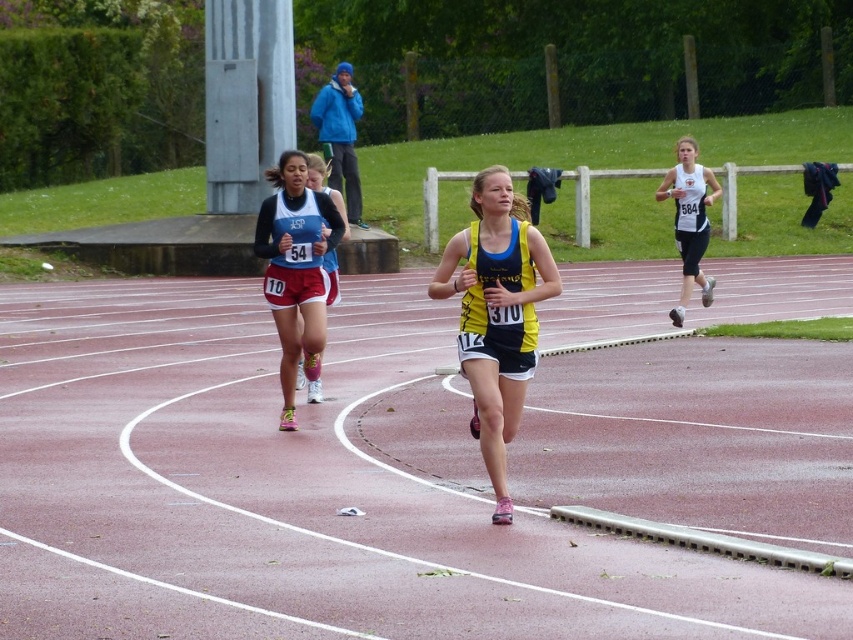
Looking at this image, is matte black shorts at center thinner than white athletic top at right?

Yes, matte black shorts at center is thinner than white athletic top at right.

Between point (291, 339) and point (688, 296), which one is positioned behind?

Point (688, 296)

Which is behind, point (282, 298) or point (656, 195)?

The point (656, 195) is more distant.

You are a GUI agent. You are given a task and a screenshot of the screen. Output one action in this format:
    pyautogui.click(x=<x>, y=<y>)
    Task: Click on the matte black shorts at center
    
    Given the screenshot: What is the action you would take?
    pyautogui.click(x=296, y=269)

Which of these two, yellow fabric tank top at center or matte black shorts at center, stands shorter?

With less height is yellow fabric tank top at center.

Can you confirm if yellow fabric tank top at center is positioned below matte black shorts at center?

Correct, yellow fabric tank top at center is located below matte black shorts at center.

Which is in front, point (491, 221) or point (302, 300)?

Point (491, 221)

Where is `yellow fabric tank top at center`? yellow fabric tank top at center is located at coordinates (496, 314).

Which is more to the right, rubberized red track at center or matte black shorts at center?

Positioned to the right is rubberized red track at center.

Is rubberized red track at center further to the viewer compared to matte black shorts at center?

No, rubberized red track at center is in front of matte black shorts at center.

Find the location of a particular element. rubberized red track at center is located at coordinates (397, 476).

This screenshot has width=853, height=640. In order to click on rubberized red track at center in this screenshot , I will do `click(397, 476)`.